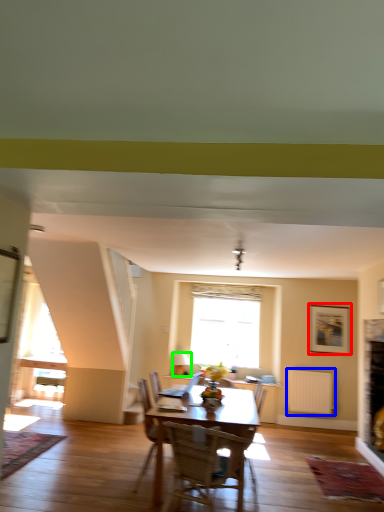
Question: Based on their relative distances, which object is farther from picture frame (highlighted by a red box)? Choose from radiator (highlighted by a blue box) and lamp (highlighted by a green box).

Choices:
 (A) radiator
 (B) lamp

Answer: (B)